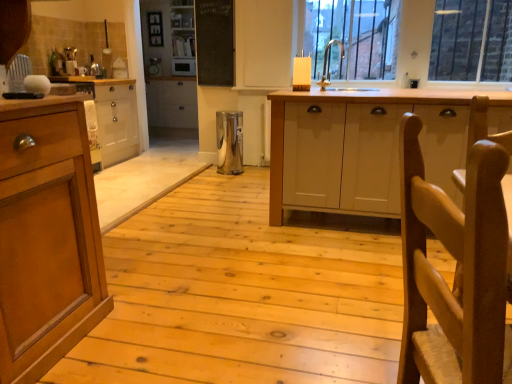
Question: From the image's perspective, is metallic trash can at center, marked as the 2th appliance in a left-to-right arrangement, over white matte cabinet at center, which is the 1th cabinetry from right to left?

Choices:
 (A) no
 (B) yes

Answer: (B)

Question: Is metallic trash can at center, marked as the 2th appliance in a left-to-right arrangement, wider than white matte cabinet at center, which is the 1th cabinetry from right to left?

Choices:
 (A) yes
 (B) no

Answer: (B)

Question: Is metallic trash can at center, marked as the second appliance in a back-to-front arrangement, far from white matte cabinet at center, marked as the 2th cabinetry in a left-to-right arrangement?

Choices:
 (A) yes
 (B) no

Answer: (A)

Question: From a real-world perspective, does metallic trash can at center, marked as the second appliance in a back-to-front arrangement, sit lower than white matte cabinet at center, which is the second cabinetry from back to front?

Choices:
 (A) no
 (B) yes

Answer: (B)

Question: Is metallic trash can at center, marked as the second appliance in a back-to-front arrangement, not inside white matte cabinet at center, marked as the 2th cabinetry in a left-to-right arrangement?

Choices:
 (A) yes
 (B) no

Answer: (A)

Question: Does metallic trash can at center, which appears as the 1th appliance when ordered from the bottom, appear on the left side of white matte cabinet at center, marked as the 2th cabinetry in a left-to-right arrangement?

Choices:
 (A) yes
 (B) no

Answer: (A)

Question: Is wooden cabinet at left, which is the first cabinetry in back-to-front order, positioned with its back to satin silver microwave at center, which ranks as the 1th appliance in left-to-right order?

Choices:
 (A) yes
 (B) no

Answer: (B)

Question: Is wooden cabinet at left, the 2th cabinetry from the front, located outside satin silver microwave at center, which appears as the second appliance when ordered from the bottom?

Choices:
 (A) yes
 (B) no

Answer: (A)

Question: Are wooden cabinet at left, the 2th cabinetry from the front, and satin silver microwave at center, marked as the second appliance in a right-to-left arrangement, making contact?

Choices:
 (A) yes
 (B) no

Answer: (B)

Question: Does wooden cabinet at left, which is the first cabinetry in back-to-front order, have a smaller size compared to satin silver microwave at center, marked as the second appliance in a right-to-left arrangement?

Choices:
 (A) no
 (B) yes

Answer: (A)

Question: Does wooden cabinet at left, the 2th cabinetry from the front, have a greater height compared to satin silver microwave at center, marked as the second appliance in a right-to-left arrangement?

Choices:
 (A) no
 (B) yes

Answer: (B)

Question: Is wooden cabinet at left, which is the first cabinetry in back-to-front order, wider than satin silver microwave at center, marked as the second appliance in a right-to-left arrangement?

Choices:
 (A) no
 (B) yes

Answer: (B)

Question: Can you confirm if wooden cabinet at left, the 2th cabinetry from the front, is wider than silver metallic sink at upper center?

Choices:
 (A) no
 (B) yes

Answer: (B)